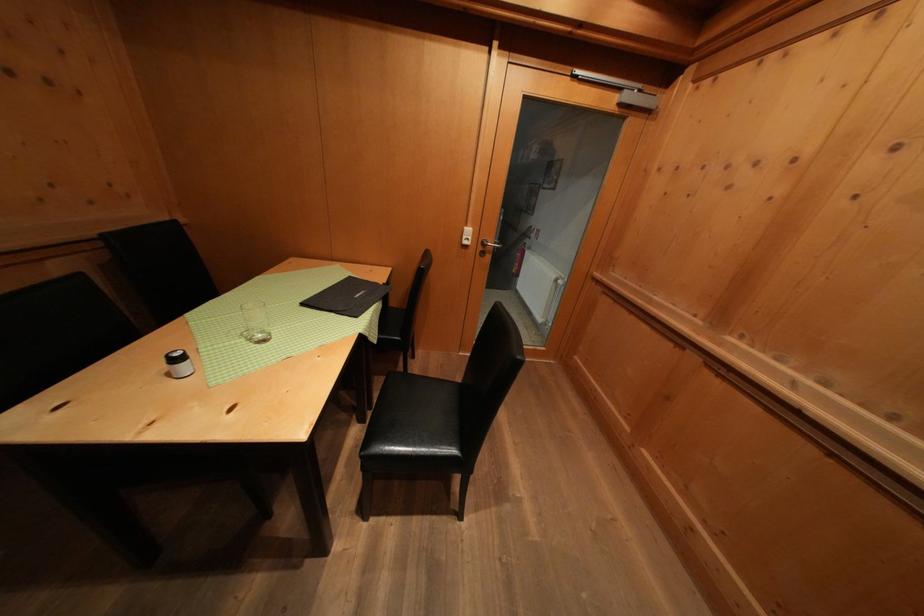
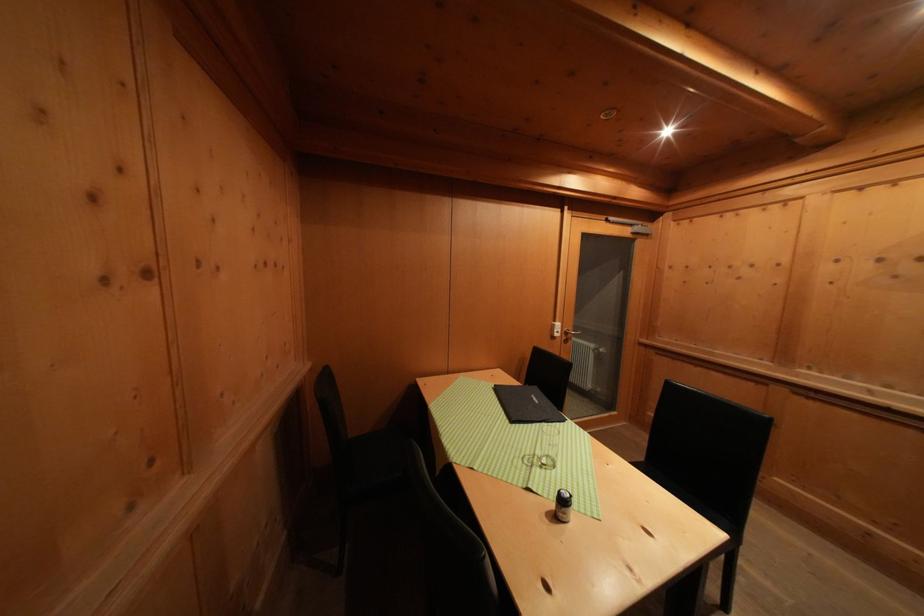
Question: Which direction would the cameraman need to move to produce the second image? Reply with the corresponding letter.

Choices:
 (A) Left
 (B) Right
 (C) Forward
 (D) Backward

Answer: (A)